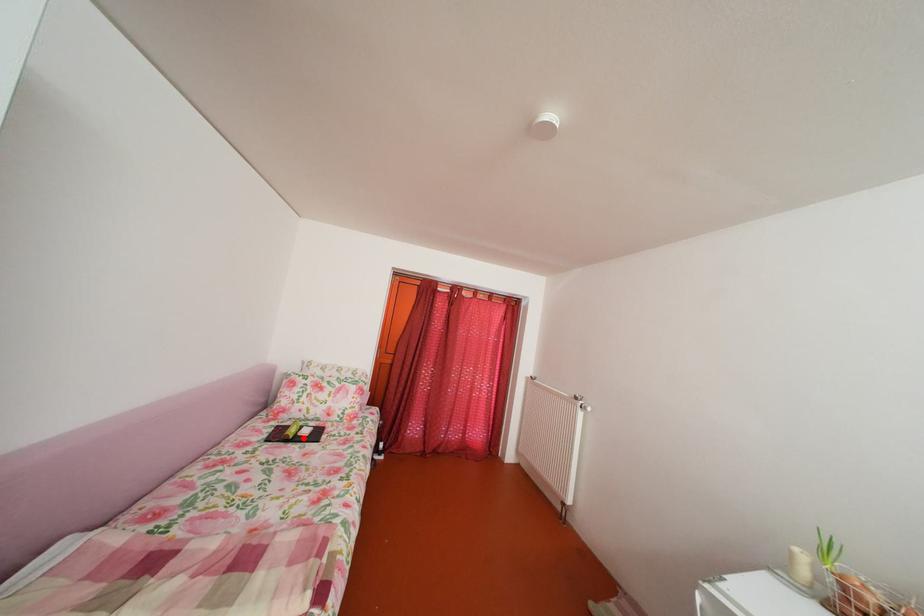
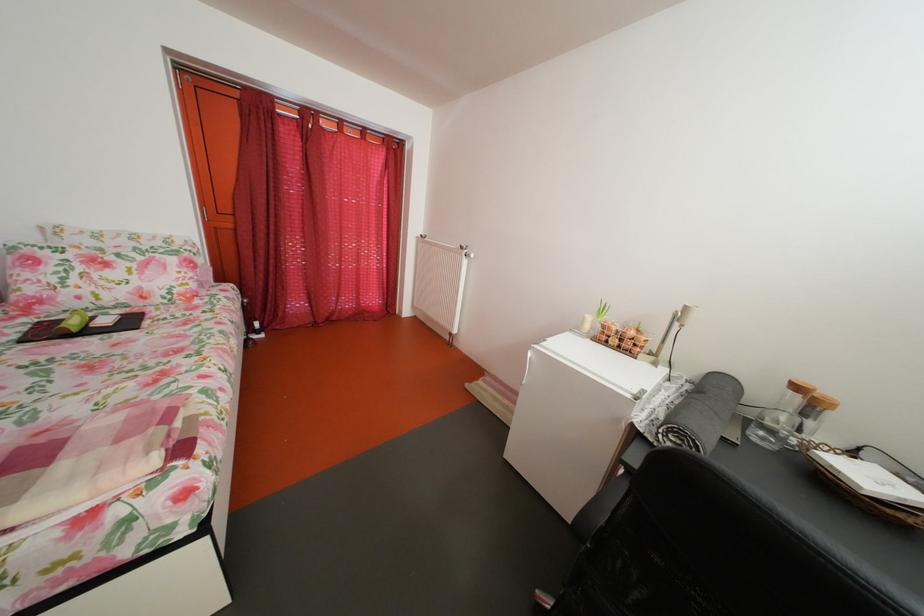
Question: I am providing you with two images of the same scene from different viewpoints. In image1, a red point is highlighted. Considering the same 3D point in image2, which of the following is correct?

Choices:
 (A) It is closer
 (B) It is farther

Answer: (A)